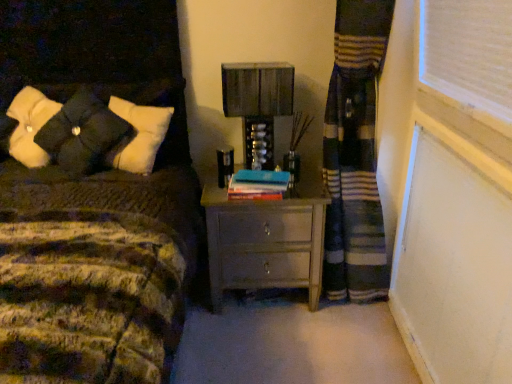
Question: Can you confirm if blue matte book at center is bigger than matte gray nightstand at center?

Choices:
 (A) yes
 (B) no

Answer: (B)

Question: Is blue matte book at center not within matte gray nightstand at center?

Choices:
 (A) no
 (B) yes

Answer: (B)

Question: Considering the relative sizes of blue matte book at center and matte gray nightstand at center in the image provided, is blue matte book at center wider than matte gray nightstand at center?

Choices:
 (A) no
 (B) yes

Answer: (A)

Question: Would you say blue matte book at center contains matte gray nightstand at center?

Choices:
 (A) no
 (B) yes

Answer: (A)

Question: Could you tell me if blue matte book at center is turned towards matte gray nightstand at center?

Choices:
 (A) no
 (B) yes

Answer: (A)

Question: Looking at their shapes, would you say matte gray nightstand at center is wider or thinner than blue matte book at center?

Choices:
 (A) thin
 (B) wide

Answer: (B)

Question: Considering the positions of matte gray nightstand at center and blue matte book at center in the image, is matte gray nightstand at center taller or shorter than blue matte book at center?

Choices:
 (A) short
 (B) tall

Answer: (B)

Question: Is matte gray nightstand at center spatially inside blue matte book at center, or outside of it?

Choices:
 (A) outside
 (B) inside

Answer: (A)

Question: From the image's perspective, is matte gray nightstand at center located above or below blue matte book at center?

Choices:
 (A) above
 (B) below

Answer: (B)

Question: Is velvety black pillows at upper left spatially inside blue matte book at center, or outside of it?

Choices:
 (A) outside
 (B) inside

Answer: (A)

Question: Relative to blue matte book at center, is velvety black pillows at upper left in front or behind?

Choices:
 (A) front
 (B) behind

Answer: (A)

Question: From the image's perspective, is velvety black pillows at upper left located above or below blue matte book at center?

Choices:
 (A) below
 (B) above

Answer: (B)

Question: Based on their positions, is velvety black pillows at upper left located to the left or right of blue matte book at center?

Choices:
 (A) left
 (B) right

Answer: (A)

Question: In terms of height, does matte gray nightstand at center look taller or shorter compared to velvety black pillows at upper left?

Choices:
 (A) short
 (B) tall

Answer: (B)

Question: From the image's perspective, is matte gray nightstand at center positioned above or below velvety black pillows at upper left?

Choices:
 (A) below
 (B) above

Answer: (A)